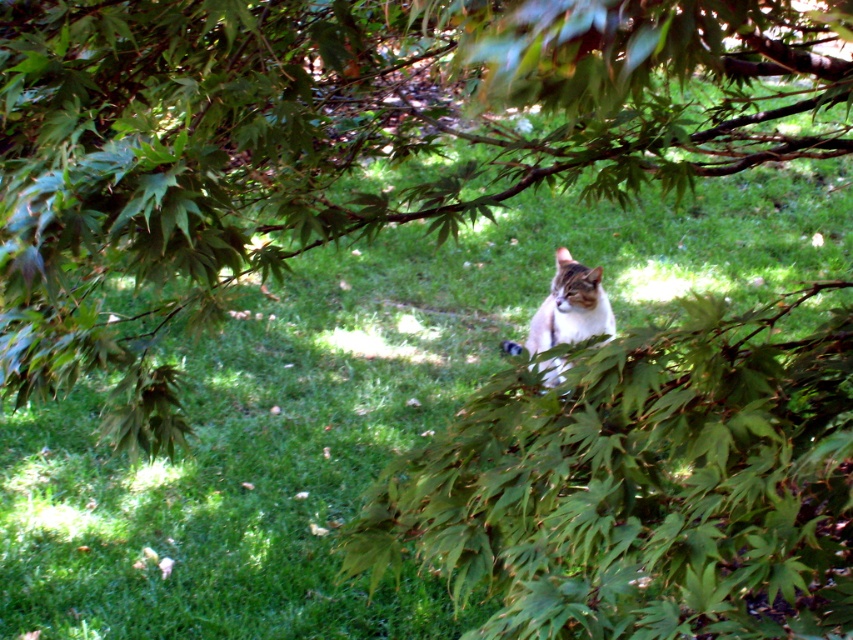
Question: Does green leafy tree at center have a lesser width compared to green leafy bush at center?

Choices:
 (A) yes
 (B) no

Answer: (B)

Question: Is green leafy bush at center further to the viewer compared to tabby fur cat at center?

Choices:
 (A) yes
 (B) no

Answer: (B)

Question: Which point is farther to the camera?

Choices:
 (A) tabby fur cat at center
 (B) green leafy bush at center
 (C) green leafy tree at center

Answer: (A)

Question: In this image, where is green leafy bush at center located relative to tabby fur cat at center?

Choices:
 (A) left
 (B) right

Answer: (A)

Question: Which point appears farthest from the camera in this image?

Choices:
 (A) [428, 122]
 (B) [502, 378]

Answer: (A)

Question: Which point is farther from the camera taking this photo?

Choices:
 (A) (538, 348)
 (B) (740, 483)
 (C) (12, 4)

Answer: (A)